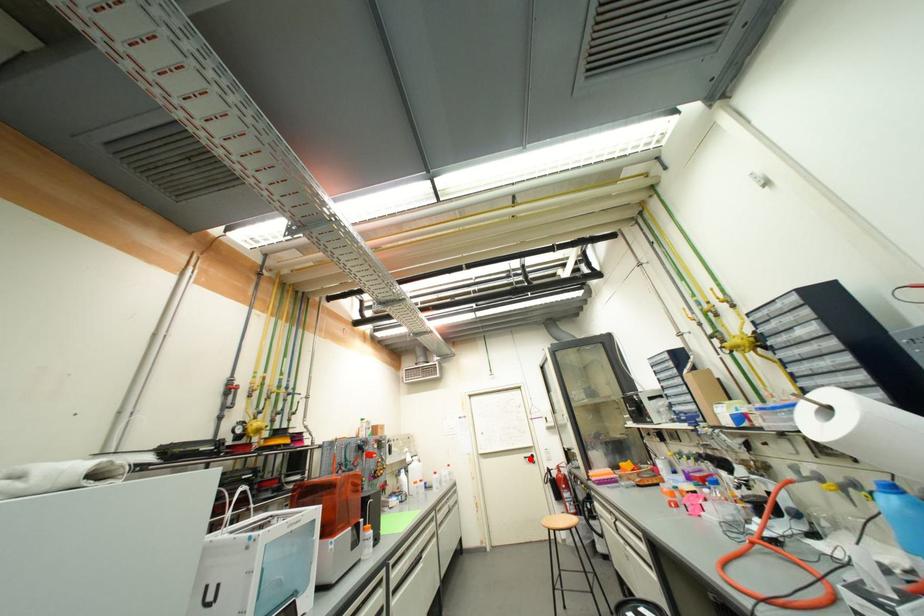
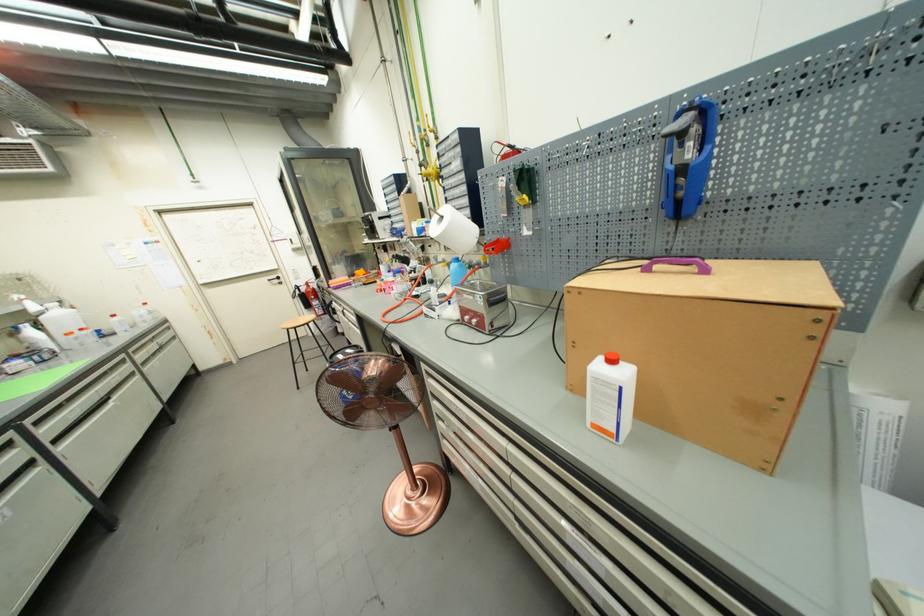
Question: I am providing you with two images of the same scene from different viewpoints. Given a red point in image1, look at the same physical point in image2. Is it:

Choices:
 (A) Closer to the viewpoint
 (B) Farther from the viewpoint

Answer: (A)